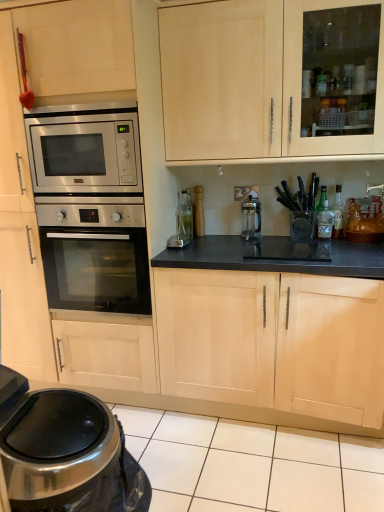
Question: Considering their positions, is stainless steel microwave oven at left located in front of or behind clear glass bottle at center-right, acting as the second bottle starting from the right?

Choices:
 (A) behind
 (B) front

Answer: (B)

Question: Considering the positions of stainless steel microwave oven at left and clear glass bottle at center-right, acting as the second bottle starting from the right, in the image, is stainless steel microwave oven at left wider or thinner than clear glass bottle at center-right, acting as the second bottle starting from the right,?

Choices:
 (A) wide
 (B) thin

Answer: (A)

Question: Which of these objects is positioned closest to the stainless steel oven at left?

Choices:
 (A) metallic trash can at lower left
 (B) satin silver coffee maker at center
 (C) clear glass bottle at center-right, the second bottle positioned from the left
 (D) light wood cabinet at center
 (E) stainless steel microwave oven at left

Answer: (E)

Question: Estimate the real-world distances between objects in this image. Which object is closer to the stainless steel oven at left?

Choices:
 (A) stainless steel microwave oven at left
 (B) light wood cabinet at center
 (C) brushed metal faucet at upper right
 (D) clear glass bottle at center right, arranged as the 1th bottle when viewed from the right
 (E) satin silver coffee maker at center

Answer: (A)